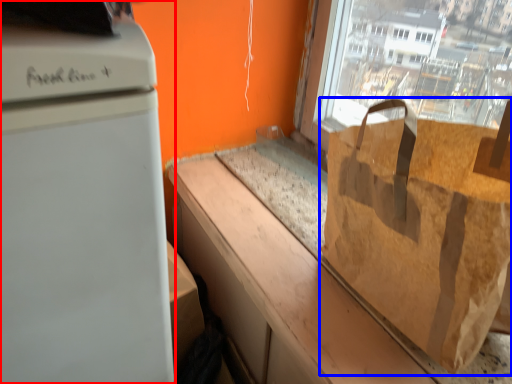
Question: Which of the following is the closest to the observer, home appliance (highlighted by a red box) or grocery bag (highlighted by a blue box)?

Choices:
 (A) home appliance
 (B) grocery bag

Answer: (A)